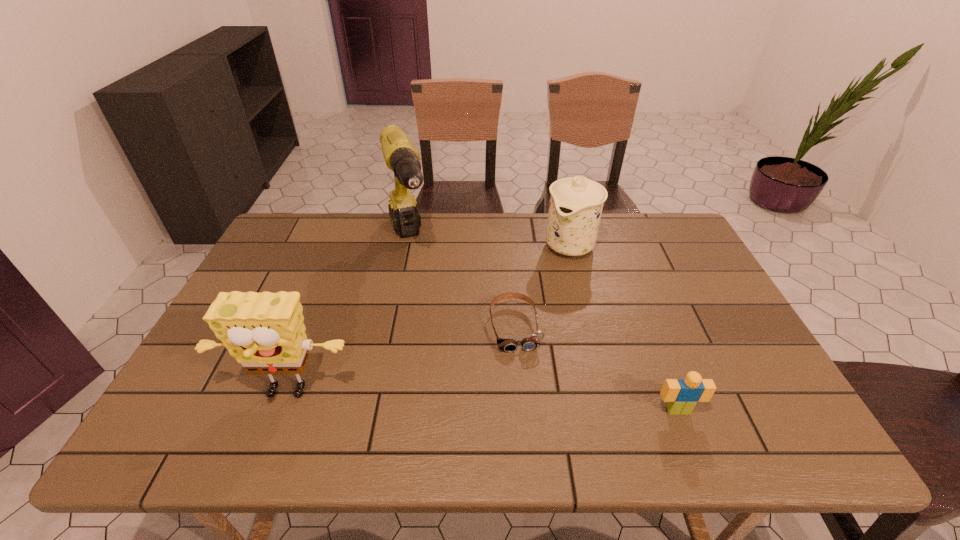
Image resolution: width=960 pixels, height=540 pixels. Find the location of `vacant area that satisfies the following two spatial constraints: 1. on the front side of the drill; 2. on the left side of the chinaware`. vacant area that satisfies the following two spatial constraints: 1. on the front side of the drill; 2. on the left side of the chinaware is located at coordinates (408, 245).